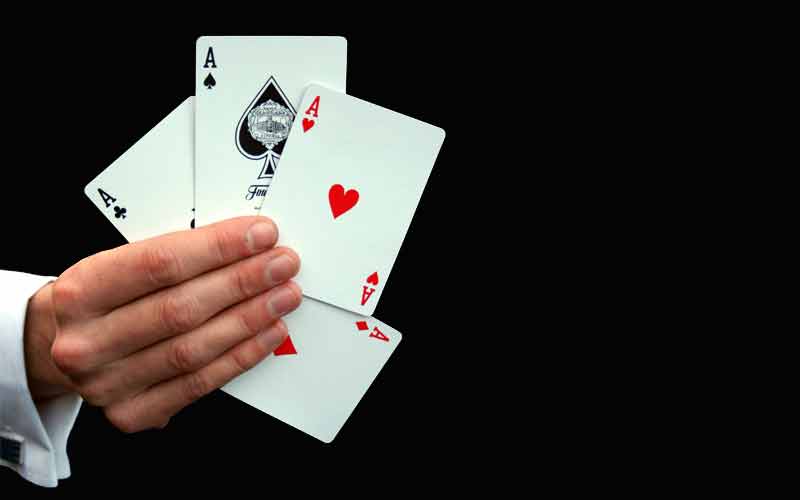
At what (x,y) coordinates should I click in order to perform the action: click on playing cards. Please return your answer as a coordinate pair (x, y). Looking at the image, I should click on (310, 390), (325, 288), (206, 191), (157, 191).